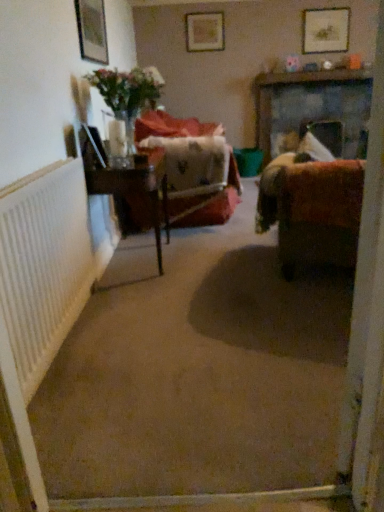
Where is `translucent glass vase at left`? The height and width of the screenshot is (512, 384). translucent glass vase at left is located at coordinates (129, 128).

This screenshot has width=384, height=512. I want to click on wooden picture frame at upper right, marked as the third picture frame in a bottom-to-top arrangement, so [x=325, y=30].

Describe the element at coordinates (44, 265) in the screenshot. Image resolution: width=384 pixels, height=512 pixels. I see `white textured radiator at left` at that location.

Where is `translucent glass vase at upper left`? The image size is (384, 512). translucent glass vase at upper left is located at coordinates (127, 94).

From the image's perspective, is white textured radiator at left above wooden picture frame at upper center, acting as the second picture frame starting from the left?

No, from the image's perspective, white textured radiator at left is not on top of wooden picture frame at upper center, acting as the second picture frame starting from the left.

Considering the positions of objects white textured radiator at left and wooden picture frame at upper center, which is the 1th picture frame in back-to-front order, in the image provided, who is more to the right, white textured radiator at left or wooden picture frame at upper center, which is the 1th picture frame in back-to-front order,?

wooden picture frame at upper center, which is the 1th picture frame in back-to-front order, is more to the right.

Can you confirm if white textured radiator at left is smaller than wooden picture frame at upper center, positioned as the second picture frame in right-to-left order?

No.

From a real-world perspective, is wooden picture frame at upper right, the first picture frame positioned from the top, physically below wooden table at center?

Actually, wooden picture frame at upper right, the first picture frame positioned from the top, is physically above wooden table at center in the real world.

Can wooden table at center be found inside wooden picture frame at upper right, marked as the third picture frame in a bottom-to-top arrangement?

Actually, wooden table at center is outside wooden picture frame at upper right, marked as the third picture frame in a bottom-to-top arrangement.

From the image's perspective, which is above, wooden picture frame at upper right, which ranks as the second picture frame in front-to-back order, or wooden table at center?

wooden picture frame at upper right, which ranks as the second picture frame in front-to-back order, is shown above in the image.

Considering the relative sizes of wooden picture frame at upper right, which appears as the 2th picture frame when viewed from the back, and wooden table at center in the image provided, is wooden picture frame at upper right, which appears as the 2th picture frame when viewed from the back, thinner than wooden table at center?

Yes.

At what (x,y) coordinates should I click in order to perform the action: click on radiator located in front of the wooden table at center. Please return your answer as a coordinate pair (x, y). Looking at the image, I should click on (44, 265).

Considering the positions of objects wooden table at center and white textured radiator at left in the image provided, who is more to the right, wooden table at center or white textured radiator at left?

wooden table at center is more to the right.

Can you confirm if wooden table at center is wider than white textured radiator at left?

Indeed, wooden table at center has a greater width compared to white textured radiator at left.

How distant is wooden table at center from white textured radiator at left?

They are 1.03 meters apart.

Between wooden picture frame at upper center, positioned as the second picture frame in right-to-left order, and translucent glass vase at upper left, which one is positioned in front?

translucent glass vase at upper left is more forward.

Considering the relative sizes of wooden picture frame at upper center, marked as the 3th picture frame in a front-to-back arrangement, and translucent glass vase at upper left in the image provided, is wooden picture frame at upper center, marked as the 3th picture frame in a front-to-back arrangement, thinner than translucent glass vase at upper left?

Yes, wooden picture frame at upper center, marked as the 3th picture frame in a front-to-back arrangement, is thinner than translucent glass vase at upper left.

From a real-world perspective, is wooden picture frame at upper center, acting as the second picture frame starting from the left, physically below translucent glass vase at upper left?

No, from a real-world perspective, wooden picture frame at upper center, acting as the second picture frame starting from the left, is not under translucent glass vase at upper left.

Who is bigger, wooden picture frame at upper center, the second picture frame positioned from the bottom, or matte wooden picture frame at upper left, placed as the 3th picture frame when sorted from right to left?

matte wooden picture frame at upper left, placed as the 3th picture frame when sorted from right to left.

From a real-world perspective, between wooden picture frame at upper center, marked as the 3th picture frame in a front-to-back arrangement, and matte wooden picture frame at upper left, arranged as the 1th picture frame when ordered from the bottom, who is vertically higher?

A: wooden picture frame at upper center, marked as the 3th picture frame in a front-to-back arrangement, is physically above.

From the image's perspective, count 1st picture frames upward from the matte wooden picture frame at upper left, placed as the 3th picture frame when sorted from right to left, and point to it. Please provide its 2D coordinates.

[(205, 31)]

Could you tell me if translucent glass vase at left is facing wooden picture frame at upper right, which appears as the 2th picture frame when viewed from the back?

No, translucent glass vase at left does not turn towards wooden picture frame at upper right, which appears as the 2th picture frame when viewed from the back.

Is translucent glass vase at left at the right side of wooden picture frame at upper right, which appears as the 2th picture frame when viewed from the back?

No, translucent glass vase at left is not to the right of wooden picture frame at upper right, which appears as the 2th picture frame when viewed from the back.

Considering the positions of point (122, 117) and point (303, 11), is point (122, 117) closer or farther from the camera than point (303, 11)?

Point (122, 117).

Which of these two, translucent glass vase at left or wooden picture frame at upper right, which appears as the 2th picture frame when viewed from the back, stands shorter?

translucent glass vase at left is shorter.

How many degrees apart are the facing directions of wooden table at center and velvet brown couch at right?

The angular difference between wooden table at center and velvet brown couch at right is 68.6 degrees.

Is wooden table at center positioned with its back to velvet brown couch at right?

No, wooden table at center is not facing the opposite direction of velvet brown couch at right.

Is wooden table at center situated inside velvet brown couch at right or outside?

wooden table at center is not enclosed by velvet brown couch at right.

From the image's perspective, is wooden table at center beneath velvet brown couch at right?

Yes.

What are the coordinates of `radiator below the wooden picture frame at upper center, the second picture frame positioned from the bottom (from the image's perspective)` in the screenshot? It's located at (44, 265).

Image resolution: width=384 pixels, height=512 pixels. Find the location of `picture frame that is the 2nd one when counting backward from the wooden table at center`. picture frame that is the 2nd one when counting backward from the wooden table at center is located at coordinates (325, 30).

Which object lies nearer to the anchor point wooden picture frame at upper center, positioned as the second picture frame in right-to-left order, wooden table at center or velvet brown couch at right?

Among the two, wooden table at center is located nearer to wooden picture frame at upper center, positioned as the second picture frame in right-to-left order.

Considering their positions, is translucent glass vase at left positioned further to velvet-like red chair at center than wooden picture frame at upper right, which is counted as the first picture frame, starting from the right?

wooden picture frame at upper right, which is counted as the first picture frame, starting from the right.

In the scene shown: From the image, which object appears to be farther from velvet brown couch at right, wooden picture frame at upper right, which is counted as the first picture frame, starting from the right, or wooden picture frame at upper center, marked as the 3th picture frame in a front-to-back arrangement?

The object further to velvet brown couch at right is wooden picture frame at upper right, which is counted as the first picture frame, starting from the right.

Looking at the image, which one is located closer to translucent glass vase at upper left, matte wooden picture frame at upper left, placed as the 3th picture frame when sorted from right to left, or wooden table at center?

matte wooden picture frame at upper left, placed as the 3th picture frame when sorted from right to left, is positioned closer to the anchor translucent glass vase at upper left.

When comparing their distances from wooden table at center, does translucent glass vase at left or velvet brown couch at right seem further?

The object further to wooden table at center is velvet brown couch at right.

When comparing their distances from white textured radiator at left, does wooden picture frame at upper right, which appears as the 3th picture frame when viewed from the left, or matte wooden picture frame at upper left, placed as the 3th picture frame when sorted from right to left, seem further?

wooden picture frame at upper right, which appears as the 3th picture frame when viewed from the left, lies further to white textured radiator at left than the other object.

Considering their positions, is matte wooden picture frame at upper left, which is counted as the 1th picture frame, starting from the front, positioned closer to wooden picture frame at upper right, which is counted as the first picture frame, starting from the right, than translucent glass vase at left?

The object closer to wooden picture frame at upper right, which is counted as the first picture frame, starting from the right, is matte wooden picture frame at upper left, which is counted as the 1th picture frame, starting from the front.

Which object lies further to the anchor point wooden picture frame at upper right, which appears as the 3th picture frame when viewed from the left, matte wooden picture frame at upper left, which is counted as the 1th picture frame, starting from the front, or wooden table at center?

wooden table at center is positioned further to the anchor wooden picture frame at upper right, which appears as the 3th picture frame when viewed from the left.

Locate an element on the screen. The width and height of the screenshot is (384, 512). vase between wooden table at center and wooden picture frame at upper center, marked as the 3th picture frame in a front-to-back arrangement, from front to back is located at coordinates (129, 128).

You are a GUI agent. You are given a task and a screenshot of the screen. Output one action in this format:
    pyautogui.click(x=<x>, y=<y>)
    Task: Click on the chair located between white textured radiator at left and wooden picture frame at upper center, which is the 1th picture frame in back-to-front order, in the depth direction
    
    Given the screenshot: What is the action you would take?
    pyautogui.click(x=194, y=170)

At what (x,y) coordinates should I click in order to perform the action: click on floral arrangement positioned between translucent glass vase at left and wooden picture frame at upper center, the second picture frame positioned from the bottom, from near to far. Please return your answer as a coordinate pair (x, y). This screenshot has height=512, width=384. Looking at the image, I should click on (127, 94).

This screenshot has width=384, height=512. Find the location of `floral arrangement between translucent glass vase at left and velvet-like red chair at center from front to back`. floral arrangement between translucent glass vase at left and velvet-like red chair at center from front to back is located at coordinates pyautogui.click(x=127, y=94).